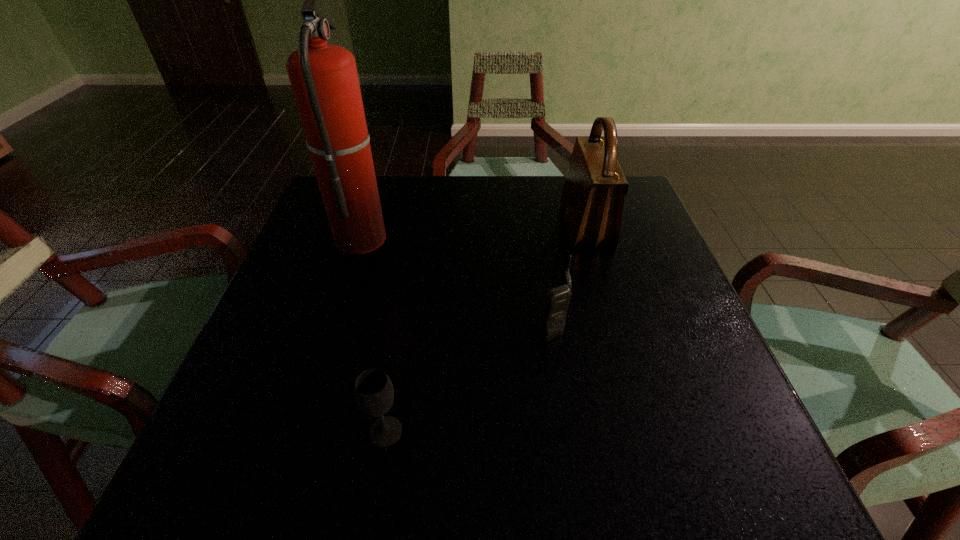
What are the coordinates of `vacant region located on the front flap of the shoulder bag` in the screenshot? It's located at (421, 226).

You are a GUI agent. You are given a task and a screenshot of the screen. Output one action in this format:
    pyautogui.click(x=<x>, y=<y>)
    Task: Click on the vacant space situated on the front flap of the shoulder bag
    This screenshot has width=960, height=540.
    Given the screenshot: What is the action you would take?
    pyautogui.click(x=442, y=226)

The height and width of the screenshot is (540, 960). Find the location of `vacant space located 0.070m on the keyboard of the second nearest object`. vacant space located 0.070m on the keyboard of the second nearest object is located at coordinates (502, 328).

At what (x,y) coordinates should I click in order to perform the action: click on free region located 0.050m on the keyboard of the second nearest object. Please return your answer as a coordinate pair (x, y). Image resolution: width=960 pixels, height=540 pixels. Looking at the image, I should click on (513, 328).

The height and width of the screenshot is (540, 960). What are the coordinates of `vacant point located 0.110m on the keyboard of the second nearest object` in the screenshot? It's located at (481, 328).

The height and width of the screenshot is (540, 960). I want to click on vacant point located 0.270m on the right of the wineglass, so click(x=574, y=431).

The width and height of the screenshot is (960, 540). I want to click on fire extinguisher located at the far edge, so click(x=324, y=79).

At what (x,y) coordinates should I click in order to perform the action: click on shoulder bag located in the far edge section of the desktop. Please return your answer as a coordinate pair (x, y). Looking at the image, I should click on pyautogui.click(x=592, y=200).

You are a GUI agent. You are given a task and a screenshot of the screen. Output one action in this format:
    pyautogui.click(x=<x>, y=<y>)
    Task: Click on the object positioned at the near edge
    
    Given the screenshot: What is the action you would take?
    pyautogui.click(x=373, y=390)

This screenshot has height=540, width=960. I want to click on object that is positioned at the left edge, so click(324, 79).